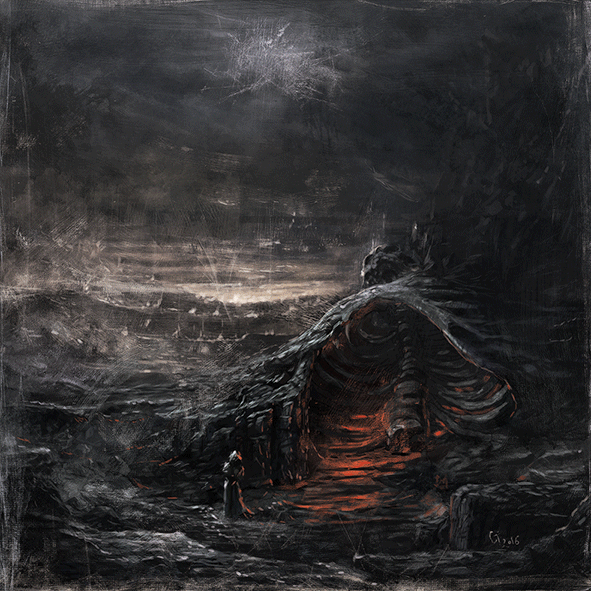
Where is `switch`? The height and width of the screenshot is (591, 591). switch is located at coordinates (232, 387).